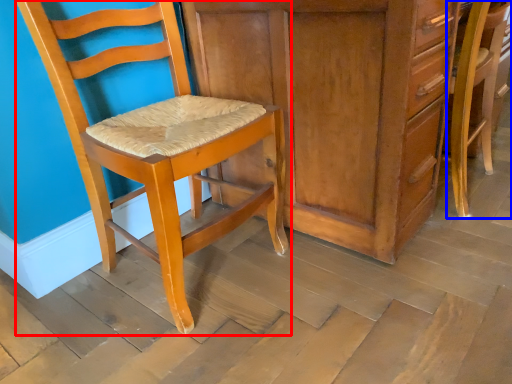
Question: Which object appears closest to the camera in this image, chair (highlighted by a red box) or chair (highlighted by a blue box)?

Choices:
 (A) chair
 (B) chair

Answer: (A)